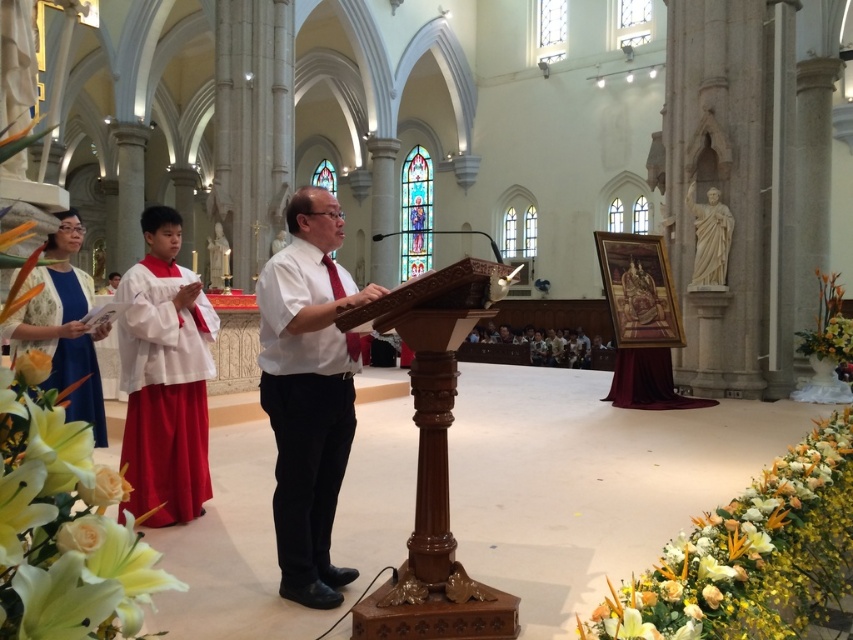
Question: Can you confirm if brown polished wood podium at center is wider than white cotton shirt at center?

Choices:
 (A) no
 (B) yes

Answer: (B)

Question: Which of the following is the farthest from the observer?

Choices:
 (A) white satin robe at left
 (B) white marble statue at right
 (C) white cotton shirt at center
 (D) brown polished wood podium at center

Answer: (B)

Question: Is brown polished wood podium at center to the left of blue satin robe at lower left from the viewer's perspective?

Choices:
 (A) no
 (B) yes

Answer: (A)

Question: Does brown polished wood podium at center lie in front of blue satin robe at lower left?

Choices:
 (A) no
 (B) yes

Answer: (B)

Question: Which of the following is the farthest from the observer?

Choices:
 (A) white cotton shirt at center
 (B) blue satin robe at lower left
 (C) brown polished wood podium at center
 (D) white marble statue at right

Answer: (D)

Question: Estimate the real-world distances between objects in this image. Which object is farther from the blue satin robe at lower left?

Choices:
 (A) white marble statue at right
 (B) white cotton shirt at center
 (C) brown polished wood podium at center

Answer: (A)